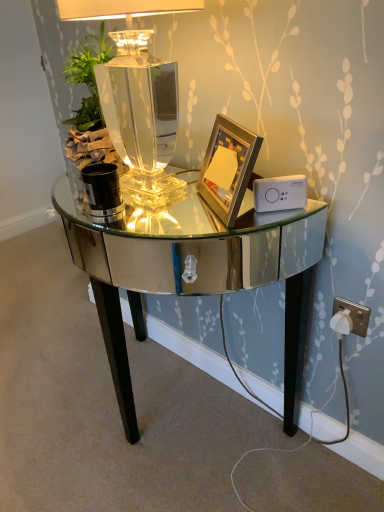
Question: Should I look upward or downward to see gold metallic picture frame at center?

Choices:
 (A) down
 (B) up

Answer: (B)

Question: Is white plastic ipod at right wider than clear glass lamp at center?

Choices:
 (A) no
 (B) yes

Answer: (A)

Question: From a real-world perspective, is white plastic ipod at right beneath clear glass lamp at center?

Choices:
 (A) yes
 (B) no

Answer: (A)

Question: Is clear glass lamp at center located within white plastic ipod at right?

Choices:
 (A) yes
 (B) no

Answer: (B)

Question: Are white plastic ipod at right and clear glass lamp at center located far from each other?

Choices:
 (A) yes
 (B) no

Answer: (B)

Question: From the image's perspective, is white plastic ipod at right located beneath clear glass lamp at center?

Choices:
 (A) no
 (B) yes

Answer: (B)

Question: Can you confirm if white plastic ipod at right is bigger than clear glass lamp at center?

Choices:
 (A) no
 (B) yes

Answer: (A)

Question: Considering the relative sizes of shiny mirrored desk at center and clear glass lamp at center in the image provided, is shiny mirrored desk at center taller than clear glass lamp at center?

Choices:
 (A) yes
 (B) no

Answer: (A)

Question: Is the position of shiny mirrored desk at center less distant than that of clear glass lamp at center?

Choices:
 (A) yes
 (B) no

Answer: (A)

Question: Is shiny mirrored desk at center further to camera compared to clear glass lamp at center?

Choices:
 (A) yes
 (B) no

Answer: (B)

Question: Is shiny mirrored desk at center to the left of clear glass lamp at center from the viewer's perspective?

Choices:
 (A) no
 (B) yes

Answer: (B)

Question: From the image's perspective, is shiny mirrored desk at center above clear glass lamp at center?

Choices:
 (A) no
 (B) yes

Answer: (A)

Question: Considering the relative sizes of shiny mirrored desk at center and clear glass lamp at center in the image provided, is shiny mirrored desk at center thinner than clear glass lamp at center?

Choices:
 (A) no
 (B) yes

Answer: (A)

Question: Considering the relative sizes of clear glass lamp at center and gold metallic picture frame at center in the image provided, is clear glass lamp at center shorter than gold metallic picture frame at center?

Choices:
 (A) yes
 (B) no

Answer: (B)